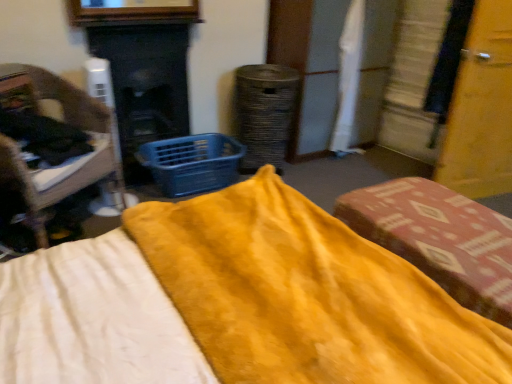
Question: From a real-world perspective, is smooth black fireplace at center-left positioned above or below wooden chair at left, placed as the 1th furniture when sorted from left to right?

Choices:
 (A) above
 (B) below

Answer: (A)

Question: From their relative heights in the image, would you say smooth black fireplace at center-left is taller or shorter than wooden chair at left, placed as the 1th furniture when sorted from left to right?

Choices:
 (A) tall
 (B) short

Answer: (A)

Question: Estimate the real-world distances between objects in this image. Which object is farther from the smooth black fireplace at center-left?

Choices:
 (A) yellow soft fabric bed at center
 (B) velvet yellow cushion at center, marked as the first furniture in a right-to-left arrangement
 (C) blue plastic basket at center
 (D) wooden chair at left, placed as the 1th furniture when sorted from left to right

Answer: (B)

Question: Which object is positioned closest to the yellow soft fabric bed at center?

Choices:
 (A) smooth black fireplace at center-left
 (B) velvet yellow cushion at center, which is the 2th furniture from left to right
 (C) wooden chair at left, the second furniture viewed from the right
 (D) blue plastic basket at center

Answer: (B)